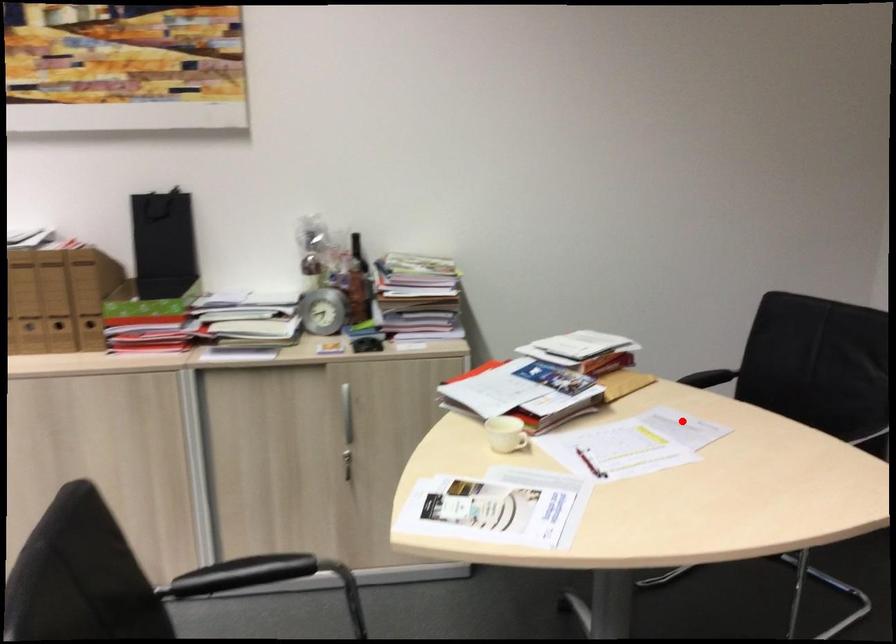
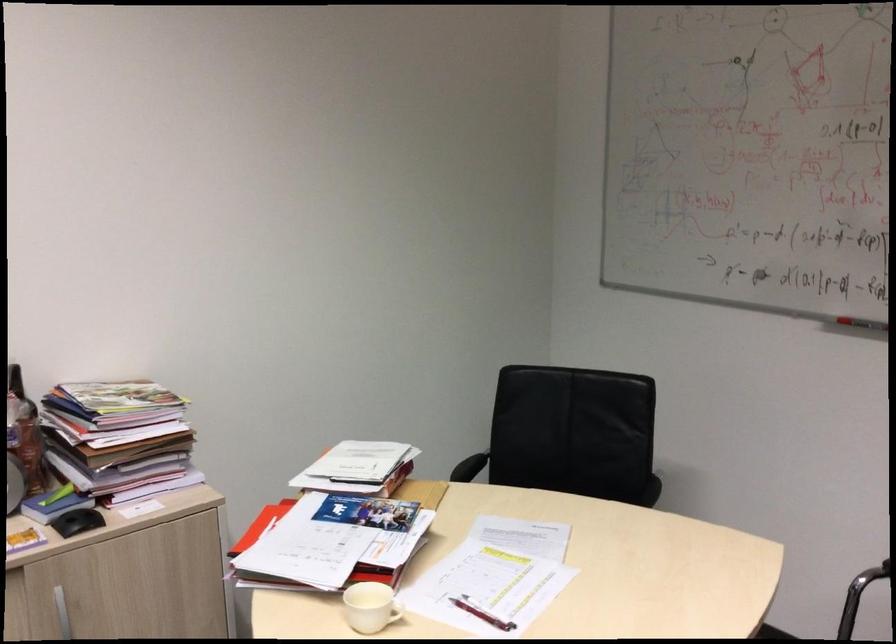
Where in the second image is the point corresponding to the highlighted location from the first image?

(515, 529)